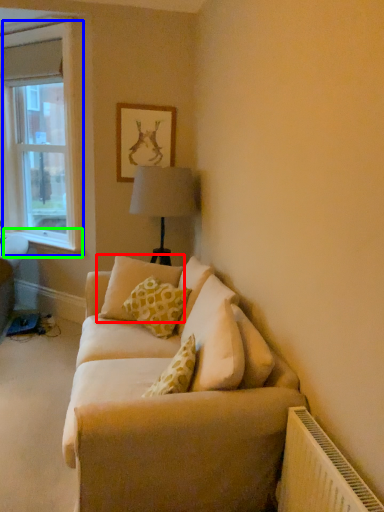
Question: Based on their relative distances, which object is nearer to pillow (highlighted by a red box)? Choose from window (highlighted by a blue box) and window sill (highlighted by a green box).

Choices:
 (A) window
 (B) window sill

Answer: (B)